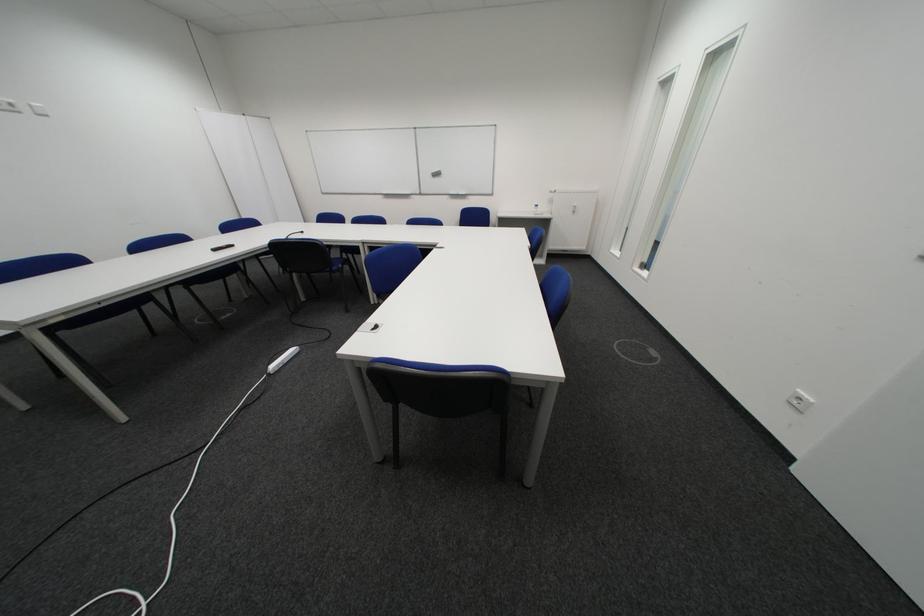
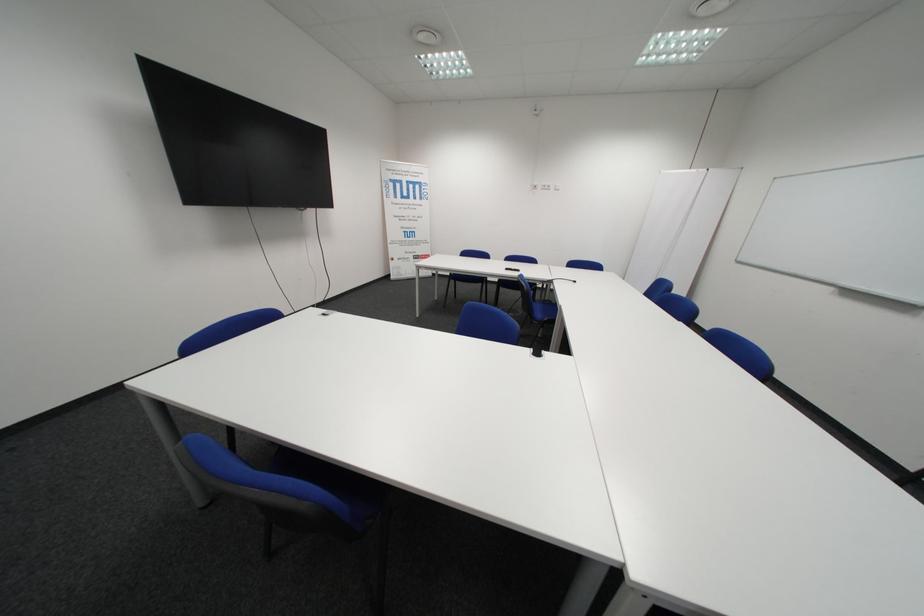
Where in the second image is the point corresponding to (x=226, y=251) from the first image?

(518, 270)